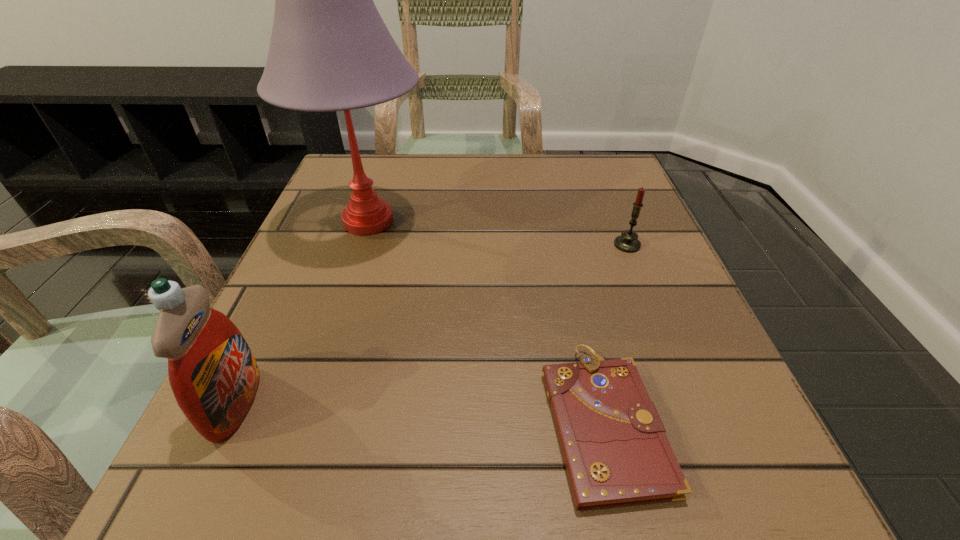
Where is `vacant area that satisfies the following two spatial constraints: 1. on the front-facing side of the third object from left to right; 2. on the right side of the tallest object`? This screenshot has height=540, width=960. vacant area that satisfies the following two spatial constraints: 1. on the front-facing side of the third object from left to right; 2. on the right side of the tallest object is located at coordinates (303, 420).

In order to click on free space that satisfies the following two spatial constraints: 1. on the back side of the second shortest object; 2. on the front-facing side of the tallest object in this screenshot , I will do `click(617, 221)`.

Where is `vacant region that satisfies the following two spatial constraints: 1. on the front-facing side of the tallest object; 2. on the back side of the third object from left to right`? vacant region that satisfies the following two spatial constraints: 1. on the front-facing side of the tallest object; 2. on the back side of the third object from left to right is located at coordinates (303, 420).

Where is `vacant point that satisfies the following two spatial constraints: 1. on the front surface of the second tallest object; 2. on the left side of the shortest object`? vacant point that satisfies the following two spatial constraints: 1. on the front surface of the second tallest object; 2. on the left side of the shortest object is located at coordinates (228, 420).

Locate an element on the screen. vacant area that satisfies the following two spatial constraints: 1. on the back side of the shortest object; 2. on the right side of the second shortest object is located at coordinates (563, 245).

Image resolution: width=960 pixels, height=540 pixels. Identify the location of vacant space that satisfies the following two spatial constraints: 1. on the front-facing side of the second object from right to left; 2. on the left side of the table lamp. (303, 420).

Find the location of a particular element. The width and height of the screenshot is (960, 540). vacant point that satisfies the following two spatial constraints: 1. on the back side of the notebook; 2. on the front surface of the detergent is located at coordinates (599, 403).

Locate an element on the screen. The width and height of the screenshot is (960, 540). free space that satisfies the following two spatial constraints: 1. on the back side of the notebook; 2. on the front surface of the third shortest object is located at coordinates (599, 403).